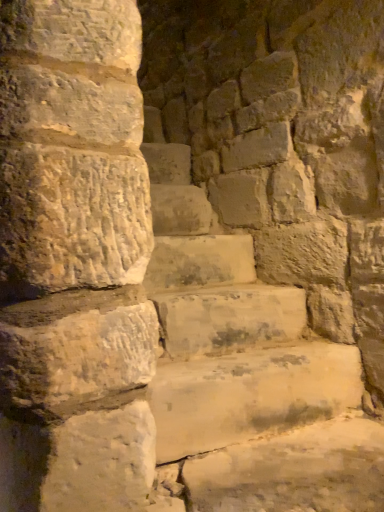
Question: Should I look upward or downward to see smooth stone brick at left?

Choices:
 (A) up
 (B) down

Answer: (B)